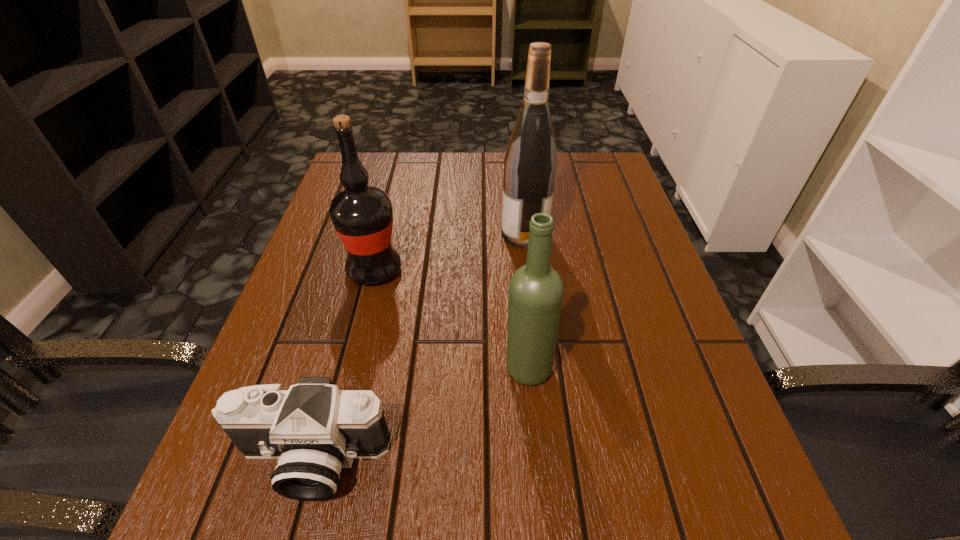
At what (x,y) coordinates should I click in order to perform the action: click on vacant space that satisfies the following two spatial constraints: 1. on the back side of the leftmost wine bottle; 2. on the left side of the nearest object. Please return your answer as a coordinate pair (x, y). The width and height of the screenshot is (960, 540). Looking at the image, I should click on (363, 270).

You are a GUI agent. You are given a task and a screenshot of the screen. Output one action in this format:
    pyautogui.click(x=<x>, y=<y>)
    Task: Click on the free space that satisfies the following two spatial constraints: 1. on the back side of the tallest object; 2. on the left side of the nearest wine bottle
    Image resolution: width=960 pixels, height=540 pixels.
    Given the screenshot: What is the action you would take?
    pyautogui.click(x=516, y=233)